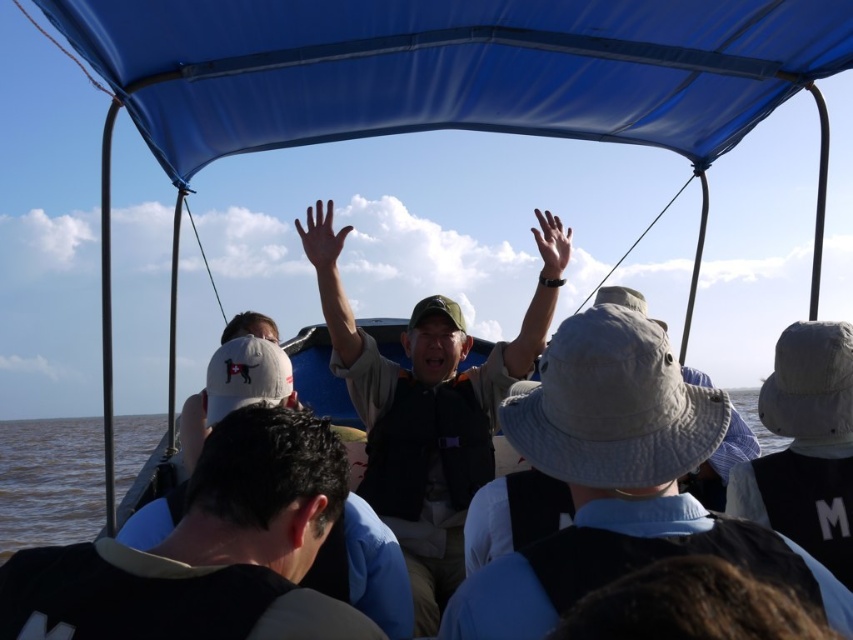
You are planning to take a photo of the blue fabric canopy at upper center and the brown water at lower left. Which object will occupy more space in your photo?

The brown water at lower left occupies more space than the blue fabric canopy at upper center in the photo.

You are a photographer trying to capture a photo of the blue fabric canopy at upper center and the brown water at lower left. Which object is located to the right of the other?

The blue fabric canopy at upper center is positioned on the right side of brown water at lower left.